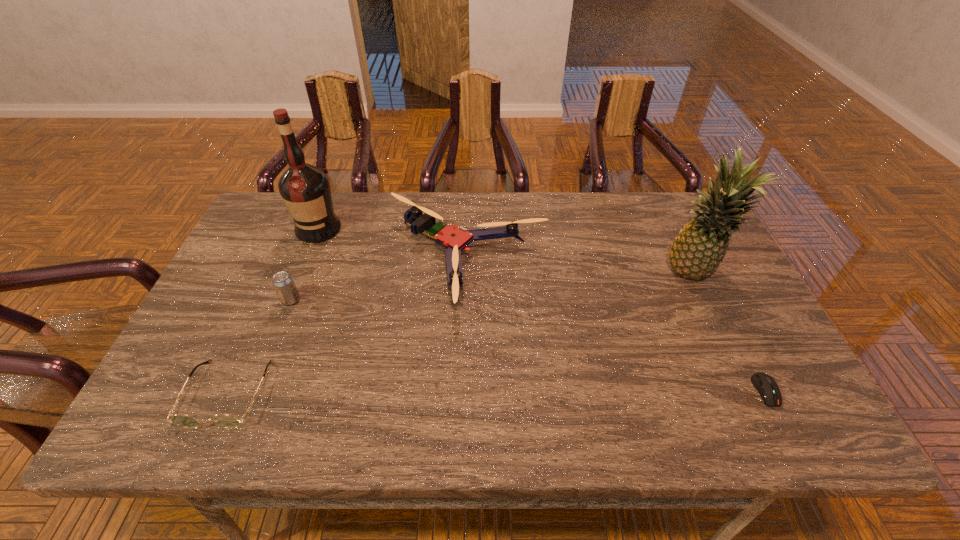
In order to click on empty space that is in between the fourth object from left to right and the pineapple in this screenshot , I will do `click(580, 269)`.

Where is `vacant space in between the drone and the liquor`? vacant space in between the drone and the liquor is located at coordinates (393, 246).

Identify the location of vacant region between the beer can and the second shortest object. (259, 347).

Image resolution: width=960 pixels, height=540 pixels. In order to click on empty location between the liquor and the beer can in this screenshot , I will do `click(304, 264)`.

Where is `vacant area that lies between the spectacles and the liquor`? The height and width of the screenshot is (540, 960). vacant area that lies between the spectacles and the liquor is located at coordinates (273, 311).

Identify the location of object identified as the fourth closest to the beer can. The height and width of the screenshot is (540, 960). (698, 249).

Image resolution: width=960 pixels, height=540 pixels. What are the coordinates of `the second closest object to the pineapple` in the screenshot? It's located at (455, 239).

What are the coordinates of `free location that satisfies the following two spatial constraints: 1. on the surface of the pineapple; 2. on the right side of the liquor` in the screenshot? It's located at (300, 274).

Image resolution: width=960 pixels, height=540 pixels. I want to click on vacant space that satisfies the following two spatial constraints: 1. on the back side of the beer can; 2. on the right side of the third object from right to left, so click(x=305, y=264).

What are the coordinates of `free space that satisfies the following two spatial constraints: 1. on the surface of the pineapple; 2. on the right side of the liquor` in the screenshot? It's located at (300, 274).